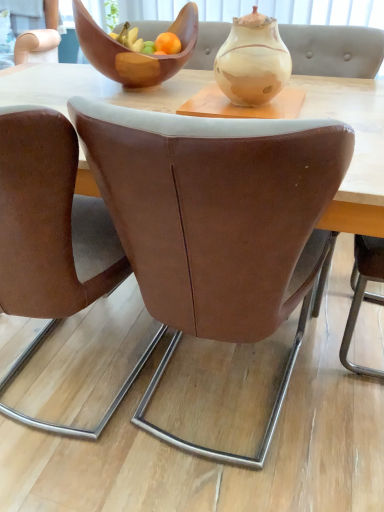
Question: Is wooden bowl at upper center positioned beyond the bounds of marbled ceramic vase at center?

Choices:
 (A) yes
 (B) no

Answer: (A)

Question: Does wooden bowl at upper center have a smaller size compared to marbled ceramic vase at center?

Choices:
 (A) yes
 (B) no

Answer: (B)

Question: Can you confirm if wooden bowl at upper center is wider than marbled ceramic vase at center?

Choices:
 (A) no
 (B) yes

Answer: (B)

Question: Is wooden bowl at upper center facing away from marbled ceramic vase at center?

Choices:
 (A) no
 (B) yes

Answer: (A)

Question: Is wooden bowl at upper center oriented towards marbled ceramic vase at center?

Choices:
 (A) yes
 (B) no

Answer: (B)

Question: Can you confirm if wooden bowl at upper center is bigger than marbled ceramic vase at center?

Choices:
 (A) no
 (B) yes

Answer: (B)

Question: Is brown leather chair at center, the 1th chair in the right-to-left sequence, at the right side of wooden bowl at upper center?

Choices:
 (A) no
 (B) yes

Answer: (B)

Question: Is brown leather chair at center, marked as the second chair in a left-to-right arrangement, oriented away from wooden bowl at upper center?

Choices:
 (A) yes
 (B) no

Answer: (B)

Question: From a real-world perspective, does brown leather chair at center, marked as the second chair in a left-to-right arrangement, stand above wooden bowl at upper center?

Choices:
 (A) no
 (B) yes

Answer: (A)

Question: Is brown leather chair at center, the 1th chair in the right-to-left sequence, closer to camera compared to wooden bowl at upper center?

Choices:
 (A) no
 (B) yes

Answer: (B)

Question: Is brown leather chair at center, the 1th chair in the right-to-left sequence, positioned beyond the bounds of wooden bowl at upper center?

Choices:
 (A) yes
 (B) no

Answer: (A)

Question: Does brown leather chair at center, the 1th chair in the right-to-left sequence, have a smaller size compared to wooden bowl at upper center?

Choices:
 (A) yes
 (B) no

Answer: (B)

Question: Is marbled ceramic vase at center to the right of brown leather chair at center, marked as the second chair in a left-to-right arrangement, from the viewer's perspective?

Choices:
 (A) yes
 (B) no

Answer: (A)